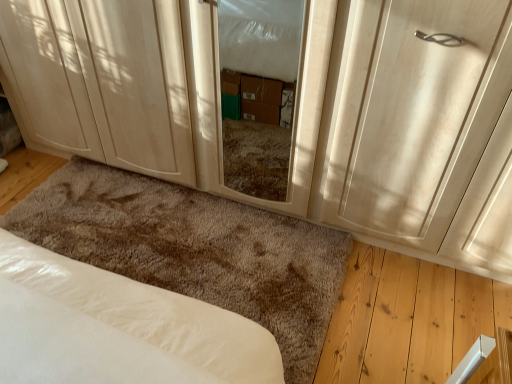
Question: From the image's perspective, is transparent glass screen door at center located above or below white soft bed at lower left?

Choices:
 (A) below
 (B) above

Answer: (B)

Question: In the image, is transparent glass screen door at center positioned in front of or behind white soft bed at lower left?

Choices:
 (A) behind
 (B) front

Answer: (B)

Question: Estimate the real-world distances between objects in this image. Which object is closer to the white soft bed at lower left?

Choices:
 (A) matte wood cabinet at lower left
 (B) matte wood door at center
 (C) transparent glass screen door at center

Answer: (C)

Question: Which object is positioned farthest from the transparent glass screen door at center?

Choices:
 (A) matte wood door at center
 (B) white soft bed at lower left
 (C) matte wood cabinet at lower left

Answer: (B)